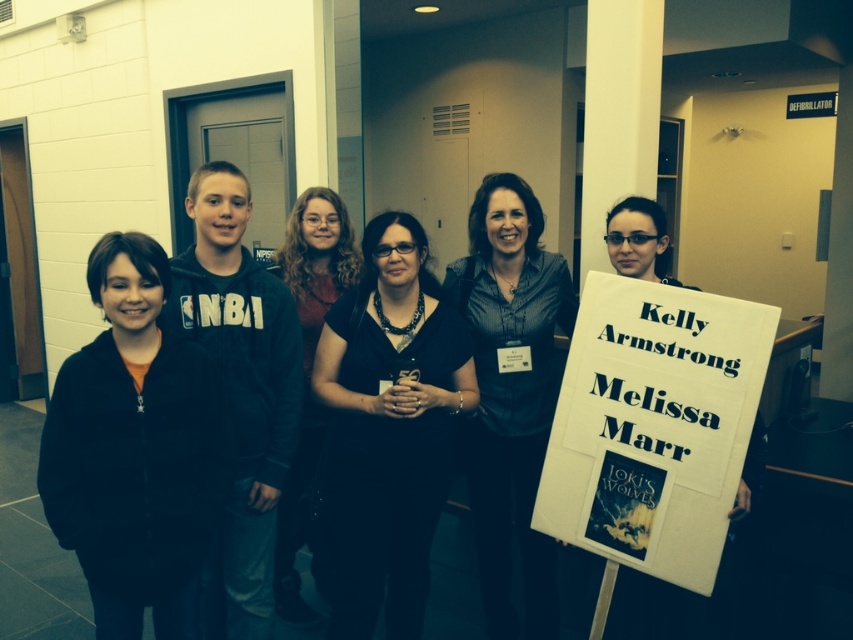
Question: Which point is farther to the camera?

Choices:
 (A) dark blue shirt at center
 (B) white paper sign at center
 (C) dark brown hair at center
 (D) black matte dress at center

Answer: (C)

Question: Based on their relative distances, which object is nearer to the matte black jacket at center?

Choices:
 (A) dark brown hair at center
 (B) dark blue shirt at center
 (C) white paper sign at center
 (D) black matte dress at center

Answer: (D)

Question: Considering the relative positions of black matte dress at center and dark brown hair at center in the image provided, where is black matte dress at center located with respect to dark brown hair at center?

Choices:
 (A) above
 (B) below

Answer: (B)

Question: Is the position of dark blue shirt at center more distant than that of dark brown hair at center?

Choices:
 (A) yes
 (B) no

Answer: (B)

Question: Considering the real-world distances, which object is closest to the white paper sign at center?

Choices:
 (A) matte black jacket at center
 (B) dark brown hair at center

Answer: (A)

Question: Does dark blue shirt at center have a smaller size compared to dark brown hair at center?

Choices:
 (A) no
 (B) yes

Answer: (B)